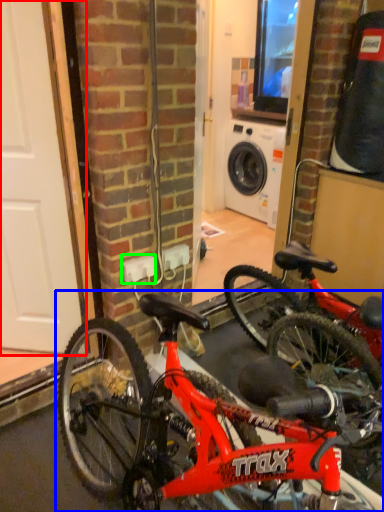
Question: Considering the real-world distances, which object is closest to door (highlighted by a red box)? bicycle (highlighted by a blue box) or electric outlet (highlighted by a green box).

Choices:
 (A) bicycle
 (B) electric outlet

Answer: (B)